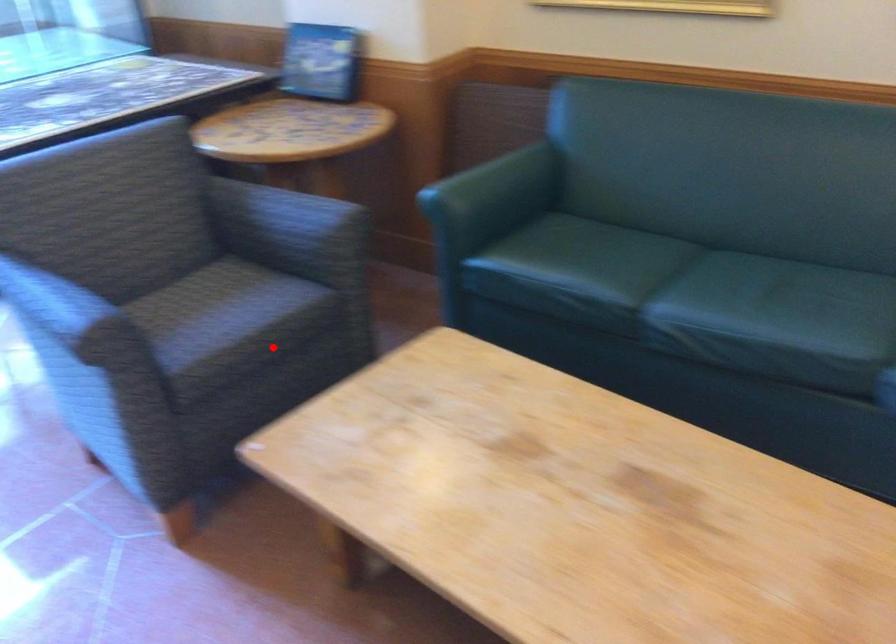
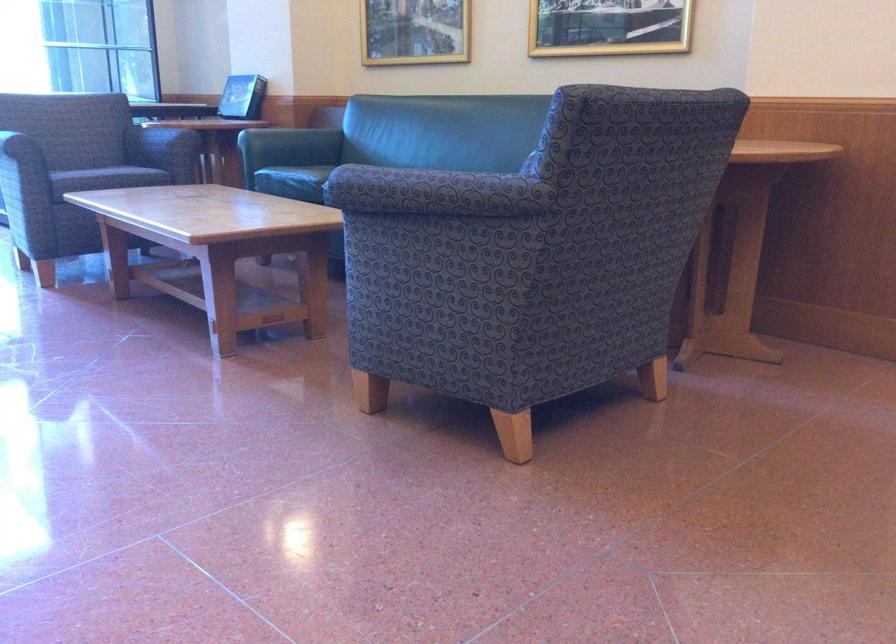
Question: I am providing you with two images of the same scene from different viewpoints. In image1, a red point is highlighted. Considering the same 3D point in image2, which of the following is correct?

Choices:
 (A) It is closer
 (B) It is farther

Answer: (B)